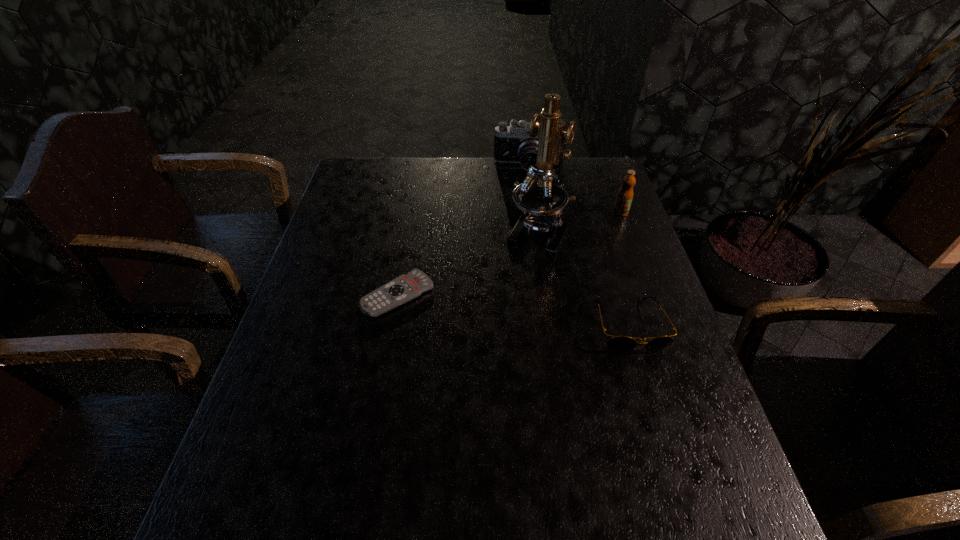
The height and width of the screenshot is (540, 960). Find the location of `orange juice situated at the right edge`. orange juice situated at the right edge is located at coordinates (624, 198).

In the image, there is a desktop. Identify the location of vacant space at the far edge. (478, 173).

This screenshot has height=540, width=960. Identify the location of vacant area at the left edge of the desktop. point(305,280).

This screenshot has height=540, width=960. I want to click on vacant space at the right edge of the desktop, so [648, 363].

The width and height of the screenshot is (960, 540). In order to click on vacant region at the far left corner of the desktop in this screenshot , I will do `click(369, 166)`.

This screenshot has width=960, height=540. I want to click on vacant space at the near left corner, so click(242, 433).

Image resolution: width=960 pixels, height=540 pixels. Find the location of `vacant space at the far right corner`. vacant space at the far right corner is located at coordinates (582, 169).

You are a GUI agent. You are given a task and a screenshot of the screen. Output one action in this format:
    pyautogui.click(x=<x>, y=<y>)
    Task: Click on the vacant space at the near right corner of the desktop
    This screenshot has width=960, height=540.
    Given the screenshot: What is the action you would take?
    pyautogui.click(x=665, y=437)

Locate an element on the screen. vacant area that lies between the farthest object and the sunglasses is located at coordinates (579, 246).

This screenshot has width=960, height=540. Find the location of `blank region between the leftmost object and the tallest object`. blank region between the leftmost object and the tallest object is located at coordinates (468, 262).